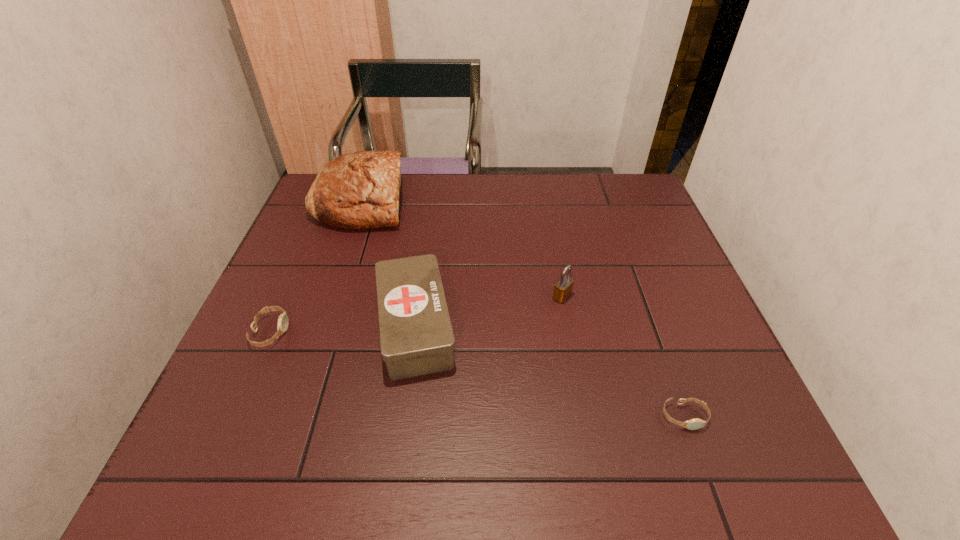
Identify the location of the farthest object. (360, 190).

The image size is (960, 540). What are the coordinates of `the tallest object` in the screenshot? It's located at (360, 190).

The image size is (960, 540). In order to click on the second object from right to left in this screenshot , I will do `click(563, 288)`.

Find the location of a particular element. the first-aid kit is located at coordinates (416, 335).

At what (x,y) coordinates should I click in order to perform the action: click on the farther watch. Please return your answer as a coordinate pair (x, y). This screenshot has height=540, width=960. Looking at the image, I should click on (283, 321).

Find the location of a particular element. This screenshot has height=540, width=960. the second shortest object is located at coordinates (283, 321).

You are a GUI agent. You are given a task and a screenshot of the screen. Output one action in this format:
    pyautogui.click(x=<x>, y=<y>)
    Task: Click on the nearest object
    The image size is (960, 540).
    Given the screenshot: What is the action you would take?
    pyautogui.click(x=693, y=424)

At what (x,y) coordinates should I click in order to perform the action: click on the rightmost object. Please return your answer as a coordinate pair (x, y). Looking at the image, I should click on (693, 424).

Locate an element on the screen. This screenshot has height=540, width=960. free space located at the sliced front of the bread is located at coordinates (495, 202).

The image size is (960, 540). I want to click on vacant space situated 0.300m on the right of the second object from right to left, so click(696, 296).